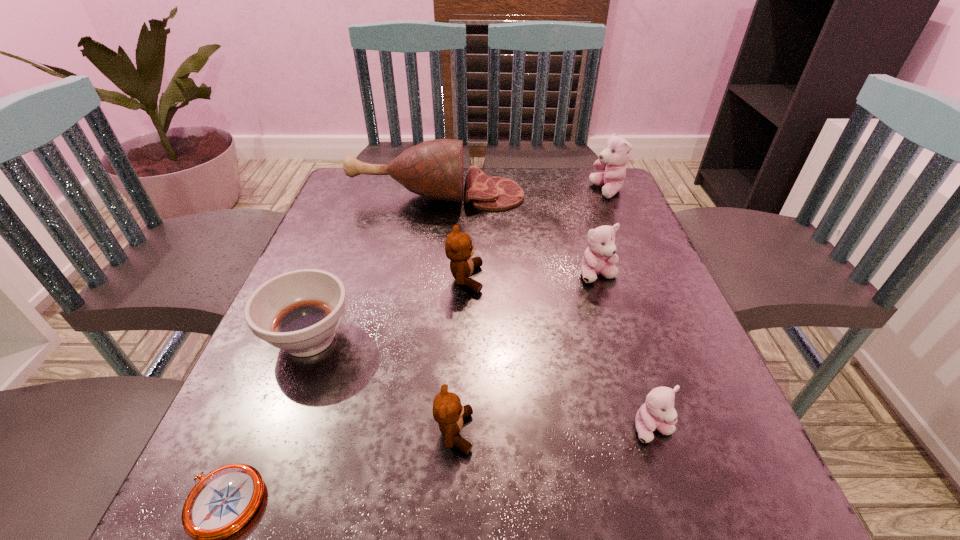
Identify the location of pink teddy bear that is the second closest to the nearer brown teddy bear. (599, 256).